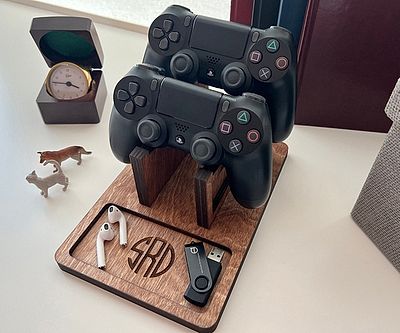
This screenshot has height=333, width=400. I want to click on binded books, so click(328, 46), click(293, 20), click(270, 11), click(241, 8).